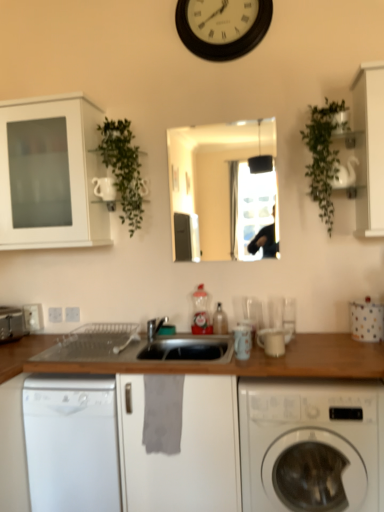
I want to click on free spot in front of matte ceramic mug at center, the third appliance positioned from the right, so click(245, 366).